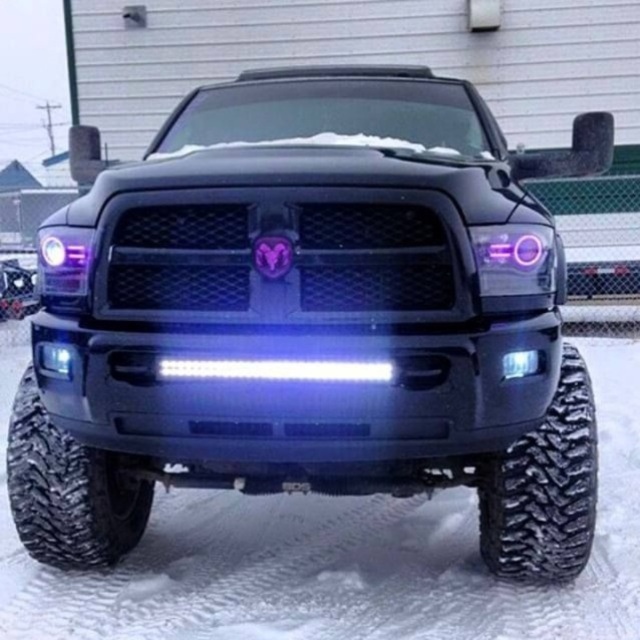
Question: Among these objects, which one is farthest from the camera?

Choices:
 (A) black rubber tire at lower left
 (B) black textured tire at lower right

Answer: (A)

Question: Which point appears farthest from the camera in this image?

Choices:
 (A) (513, 528)
 (B) (36, 544)

Answer: (B)

Question: Can you confirm if black textured tire at lower right is positioned below black rubber tire at lower left?

Choices:
 (A) no
 (B) yes

Answer: (A)

Question: Is black textured tire at lower right positioned behind black rubber tire at lower left?

Choices:
 (A) no
 (B) yes

Answer: (A)

Question: Which of the following is the farthest from the observer?

Choices:
 (A) (56, 557)
 (B) (480, 550)

Answer: (B)

Question: Can you confirm if black textured tire at lower right is positioned below black rubber tire at lower left?

Choices:
 (A) yes
 (B) no

Answer: (B)